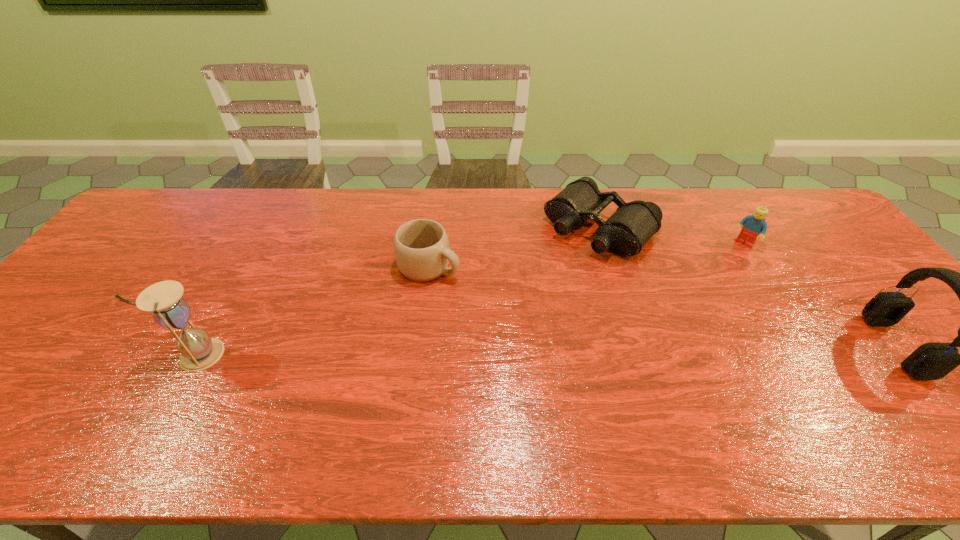
In order to click on free space that satisfies the following two spatial constraints: 1. on the back side of the Lego; 2. on the left side of the mug in this screenshot , I will do `click(432, 244)`.

Where is `blank space that satisfies the following two spatial constraints: 1. on the back side of the leftmost object; 2. on the headband of the rightmost object`? The width and height of the screenshot is (960, 540). blank space that satisfies the following two spatial constraints: 1. on the back side of the leftmost object; 2. on the headband of the rightmost object is located at coordinates (203, 346).

Find the location of a particular element. The width and height of the screenshot is (960, 540). free location that satisfies the following two spatial constraints: 1. on the back side of the mug; 2. on the left side of the hourglass is located at coordinates (247, 266).

This screenshot has width=960, height=540. Find the location of `vacant space that satisfies the following two spatial constraints: 1. on the front side of the mug; 2. on the headband of the headset`. vacant space that satisfies the following two spatial constraints: 1. on the front side of the mug; 2. on the headband of the headset is located at coordinates (420, 346).